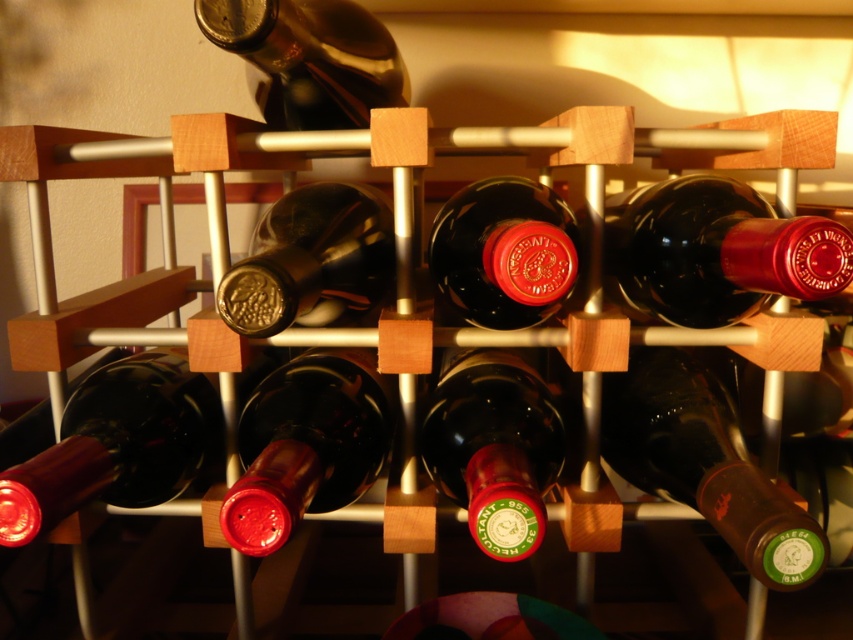
Does matte black bottle at center have a greater width compared to matte glass bottle at center?

Indeed, matte black bottle at center has a greater width compared to matte glass bottle at center.

Does matte black bottle at center appear over matte glass bottle at center?

Incorrect, matte black bottle at center is not positioned above matte glass bottle at center.

Which is in front, point (281, 465) or point (289, 284)?

Point (289, 284)

You are a GUI agent. You are given a task and a screenshot of the screen. Output one action in this format:
    pyautogui.click(x=<x>, y=<y>)
    Task: Click on the matte black bottle at center
    The width and height of the screenshot is (853, 640).
    Given the screenshot: What is the action you would take?
    pyautogui.click(x=305, y=445)

Can you confirm if shiny dark red bottle at center is wider than shiny dark glass bottle at upper center?

No, shiny dark red bottle at center is not wider than shiny dark glass bottle at upper center.

In the scene shown: Does shiny dark red bottle at center have a lesser height compared to shiny dark glass bottle at upper center?

No.

Which is behind, point (625, 280) or point (300, 68)?

Point (625, 280)

Find the location of a particular element. shiny dark red bottle at center is located at coordinates (717, 252).

Who is higher up, green matte wine bottle at center or matte dark red wine bottle at lower left?

matte dark red wine bottle at lower left is above.

Can you confirm if green matte wine bottle at center is positioned to the left of matte dark red wine bottle at lower left?

In fact, green matte wine bottle at center is to the right of matte dark red wine bottle at lower left.

This screenshot has height=640, width=853. In order to click on green matte wine bottle at center in this screenshot , I will do `click(705, 464)`.

Where is `green matte wine bottle at center`? The image size is (853, 640). green matte wine bottle at center is located at coordinates (705, 464).